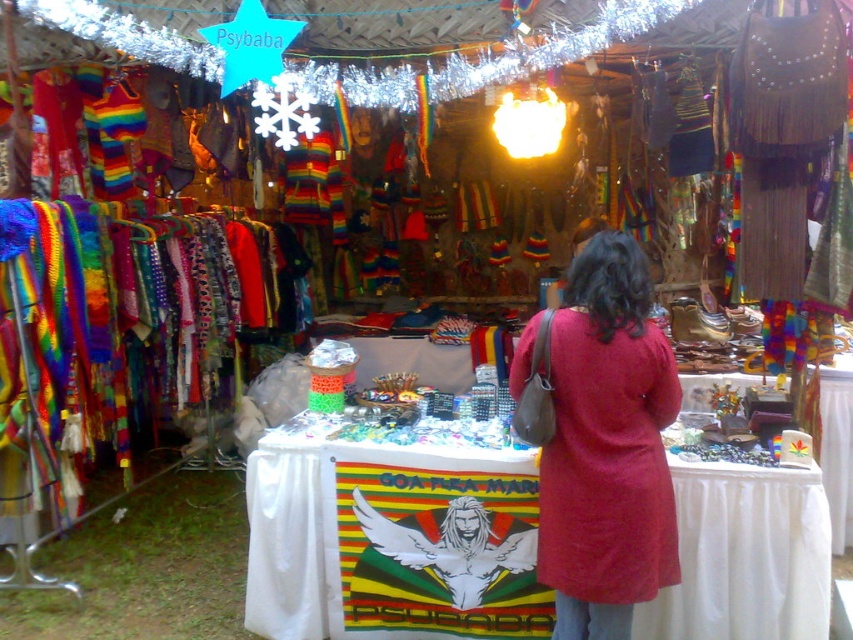
Question: In this image, where is white cloth at center located relative to matte red dress at center?

Choices:
 (A) below
 (B) above

Answer: (A)

Question: Which of the following is the closest to the observer?

Choices:
 (A) (587, 552)
 (B) (253, 452)

Answer: (A)

Question: Is white cloth at center smaller than matte red dress at center?

Choices:
 (A) yes
 (B) no

Answer: (B)

Question: Does white cloth at center come behind matte red dress at center?

Choices:
 (A) yes
 (B) no

Answer: (A)

Question: Which object appears closest to the camera in this image?

Choices:
 (A) matte red dress at center
 (B) white cloth at center

Answer: (A)

Question: Which object appears farthest from the camera in this image?

Choices:
 (A) matte red dress at center
 (B) white cloth at center

Answer: (B)